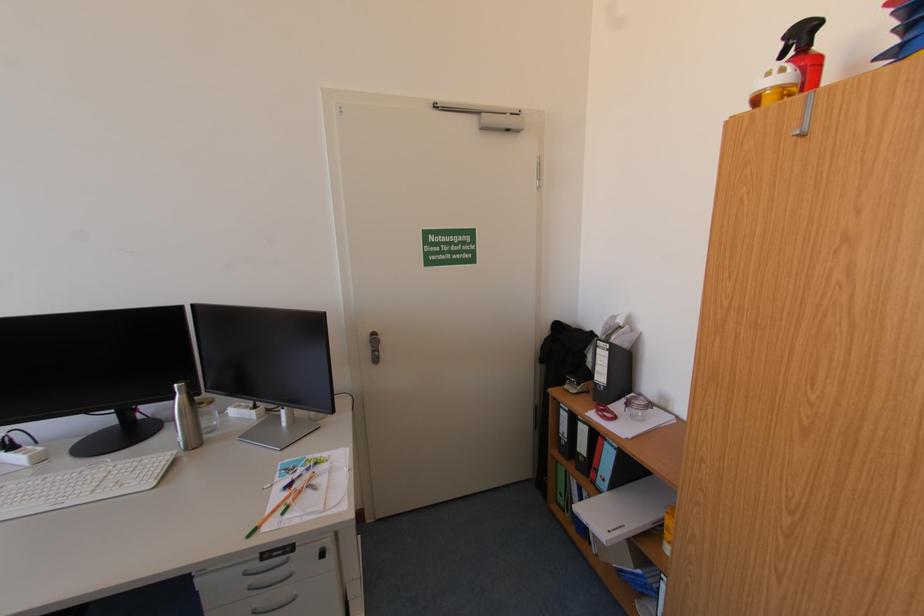
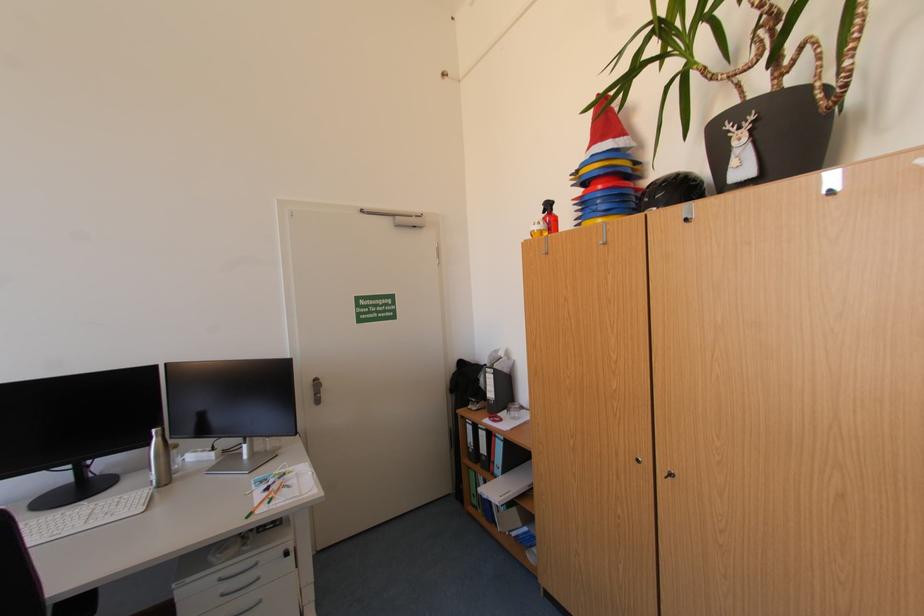
In the second image, find the point that corresponds to (374,351) in the first image.

(319, 394)